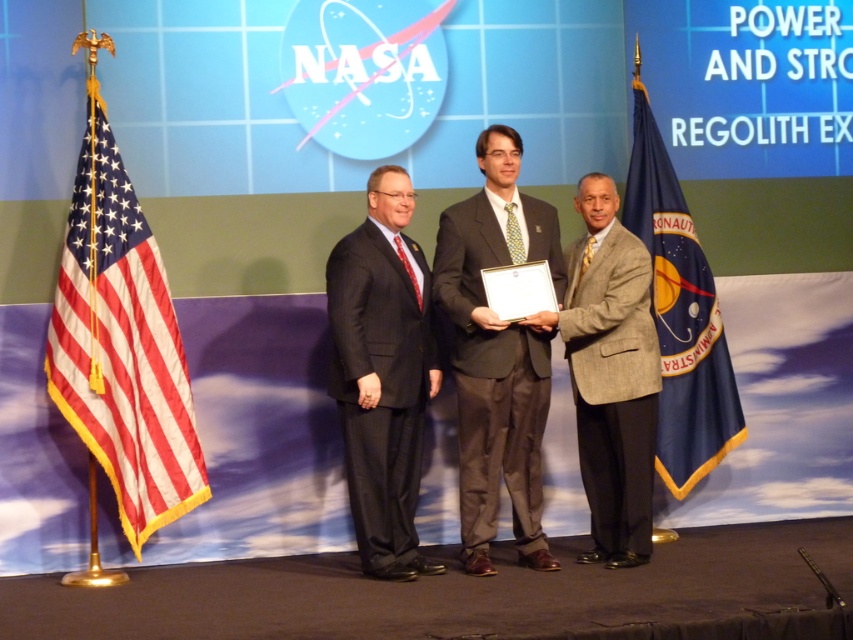
You are an event organizer at NASA who needs to place a 30 inch wide banner between the light brown textured suit at center and the blue fabric flag at right. Can you fit the banner between them without overlapping either object?

The distance between the light brown textured suit at center and the blue fabric flag at right is 28.25 inches. Since the banner is 30 inches wide, it cannot fit between them without overlapping either object.

You are a photographer at the NASA event and want to focus on the two points on the stage. Which point, point (165, 496) or point (672, 417), is closer to your camera lens?

Point (165, 496) is closer to the camera than point (672, 417).

You are an event photographer at the NASA event. You need to capture a photo of the light brown textured suit at center and the blue fabric flag at right. Which object is located more to the left in the image?

The light brown textured suit at center is positioned on the left side of the blue fabric flag at right, so it is more to the left.